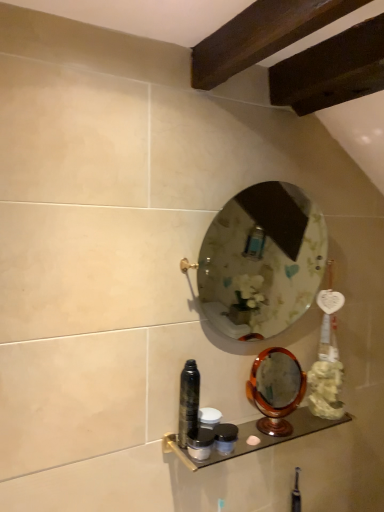
Question: From a real-world perspective, is shiny black can at center, the 4th toiletry when ordered from bottom to top, positioned above or below metallic glass shelf at lower center?

Choices:
 (A) above
 (B) below

Answer: (A)

Question: Is point (180, 395) closer or farther from the camera than point (218, 457)?

Choices:
 (A) closer
 (B) farther

Answer: (B)

Question: Estimate the real-world distances between objects in this image. Which object is farther from the matte black container at center, acting as the 2th toiletry starting from the bottom?

Choices:
 (A) shiny black can at center, the 4th toiletry when ordered from bottom to top
 (B) matte black container at lower center, the 3th toiletry when ordered from bottom to top
 (C) wooden polished mirror at lower right, positioned as the 1th mirror in bottom-to-top order
 (D) metallic glass shelf at lower center
 (E) clear glass mirror at center, positioned as the 2th mirror in bottom-to-top order

Answer: (E)

Question: Estimate the real-world distances between objects in this image. Which object is closer to the matte black container at center, the 3th toiletry from the top?

Choices:
 (A) shiny black can at center, positioned as the first toiletry in top-to-bottom order
 (B) matte black container at lower center, placed as the first toiletry when sorted from bottom to top
 (C) matte black container at lower center, the 3th toiletry when ordered from bottom to top
 (D) clear glass mirror at center, positioned as the 2th mirror in bottom-to-top order
 (E) metallic glass shelf at lower center

Answer: (B)